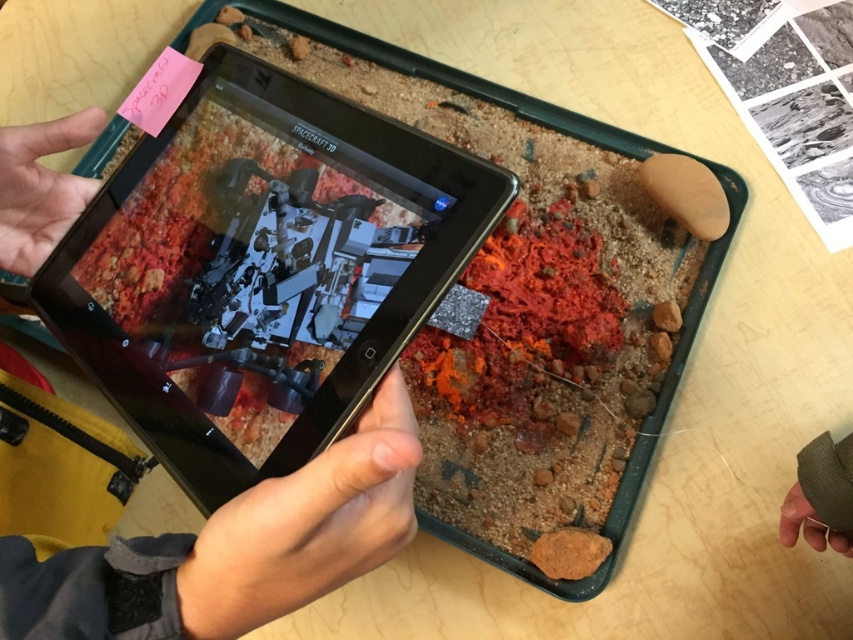
Question: Which point is closer to the camera?

Choices:
 (A) matte black tablet at center
 (B) textured gray glove at lower right

Answer: (A)

Question: Considering the relative positions of black glossy tablet at center and matte black tablet at center in the image provided, where is black glossy tablet at center located with respect to matte black tablet at center?

Choices:
 (A) below
 (B) above

Answer: (B)

Question: Is matte black tablet at center smaller than matte skin hand at upper left?

Choices:
 (A) no
 (B) yes

Answer: (A)

Question: Does black glossy tablet at center have a smaller size compared to matte skin hand at upper left?

Choices:
 (A) yes
 (B) no

Answer: (B)

Question: Which of these objects is positioned farthest from the matte black tablet at center?

Choices:
 (A) black glossy tablet at center
 (B) matte skin hand at upper left
 (C) textured gray glove at lower right

Answer: (C)

Question: Which of the following is the closest to the observer?

Choices:
 (A) black glossy tablet at center
 (B) matte skin hand at upper left
 (C) matte black tablet at center
 (D) textured gray glove at lower right

Answer: (C)